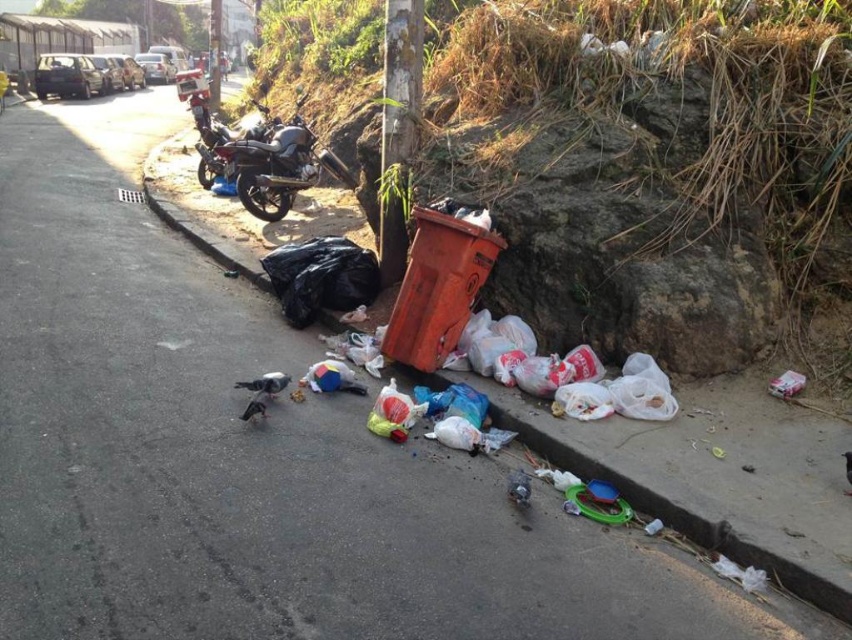
Question: Does orange plastic bin at lower right have a lesser width compared to black plastic bag at lower left?

Choices:
 (A) no
 (B) yes

Answer: (B)

Question: Where is shiny black motorcycle at center located in relation to black plastic bag at lower left in the image?

Choices:
 (A) right
 (B) left

Answer: (B)

Question: Which of the following is the closest to the observer?

Choices:
 (A) black plastic bag at lower left
 (B) orange plastic bin at lower right
 (C) shiny black motorcycle at center

Answer: (B)

Question: Is shiny black motorcycle at center above black plastic bag at lower left?

Choices:
 (A) no
 (B) yes

Answer: (B)

Question: Which of these objects is positioned closest to the black plastic bag at lower left?

Choices:
 (A) shiny black motorcycle at center
 (B) orange plastic bin at lower right

Answer: (A)

Question: Among these objects, which one is farthest from the camera?

Choices:
 (A) black plastic bag at lower left
 (B) orange plastic bin at lower right
 (C) shiny black motorcycle at center

Answer: (C)